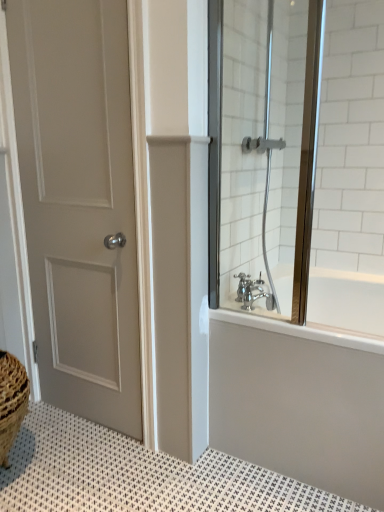
Question: Looking at their shapes, would you say white textured bath mat at lower left is wider or thinner than silver metallic faucet at lower right?

Choices:
 (A) thin
 (B) wide

Answer: (B)

Question: In the image, is white textured bath mat at lower left positioned in front of or behind silver metallic faucet at lower right?

Choices:
 (A) behind
 (B) front

Answer: (B)

Question: Which is farther from the matte gray door at left?

Choices:
 (A) white textured bath mat at lower left
 (B) clear glass shower door at right
 (C) white glossy bathtub at upper right
 (D) silver metallic faucet at lower right

Answer: (D)

Question: Estimate the real-world distances between objects in this image. Which object is closer to the white textured bath mat at lower left?

Choices:
 (A) white glossy bathtub at upper right
 (B) silver metallic faucet at lower right
 (C) matte gray door at left
 (D) clear glass shower door at right

Answer: (A)